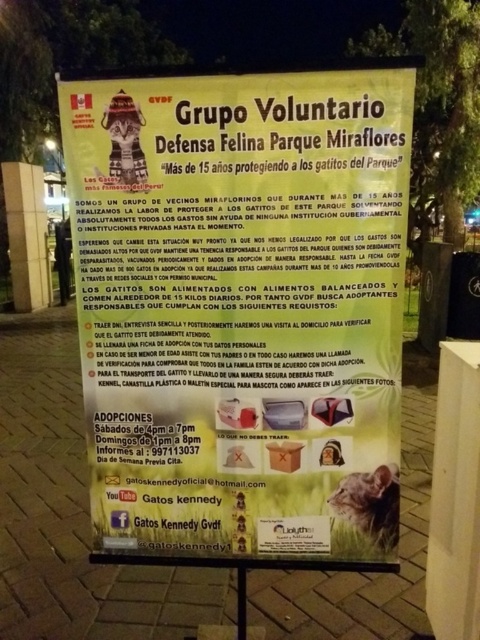
Question: Among these objects, which one is nearest to the camera?

Choices:
 (A) fuzzy brown cat at lower right
 (B) white paper poster at center

Answer: (B)

Question: In this image, where is white paper poster at center located relative to fuzzy brown cat at lower right?

Choices:
 (A) right
 (B) left

Answer: (B)

Question: Is white paper poster at center positioned at the back of fuzzy brown cat at lower right?

Choices:
 (A) yes
 (B) no

Answer: (B)

Question: Which point is farther from the camera taking this photo?

Choices:
 (A) (384, 528)
 (B) (402, 289)

Answer: (A)

Question: Can you confirm if white paper poster at center is wider than fuzzy brown cat at lower right?

Choices:
 (A) no
 (B) yes

Answer: (B)